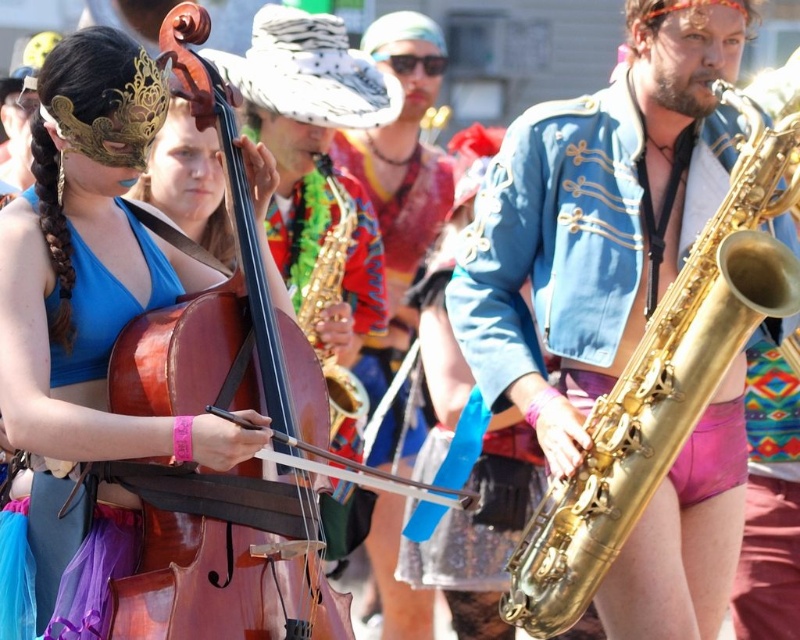
You are a photographer standing at the event. You want to take a closeup shot of the wooden cello at left. Considering the distance, is it possible to capture the cello in detail without moving closer?

The wooden cello at left is 16.22 meters away from the viewer. Since this distance is quite far, it might be challenging to capture the cello in detail without using a telephoto lens or moving closer.

You are a stagehand setting up for a performance. You need to place the wooden cello at left and the matte wood cello at left on the stage. Which cello should be placed closer to the audience to ensure visibility?

The wooden cello at left is shorter than the matte wood cello at left, so the shorter wooden cello at left should be placed closer to the audience to ensure visibility.